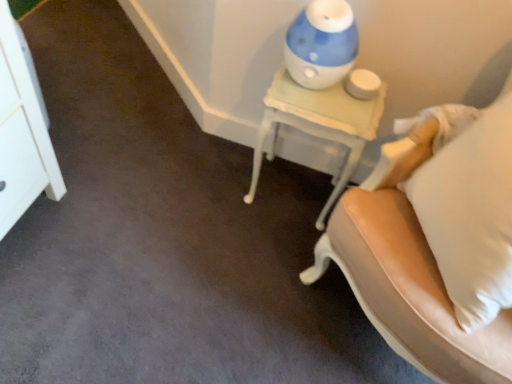
Locate an element on the screen. unoccupied area in front of white painted wood nightstand at upper right is located at coordinates (267, 249).